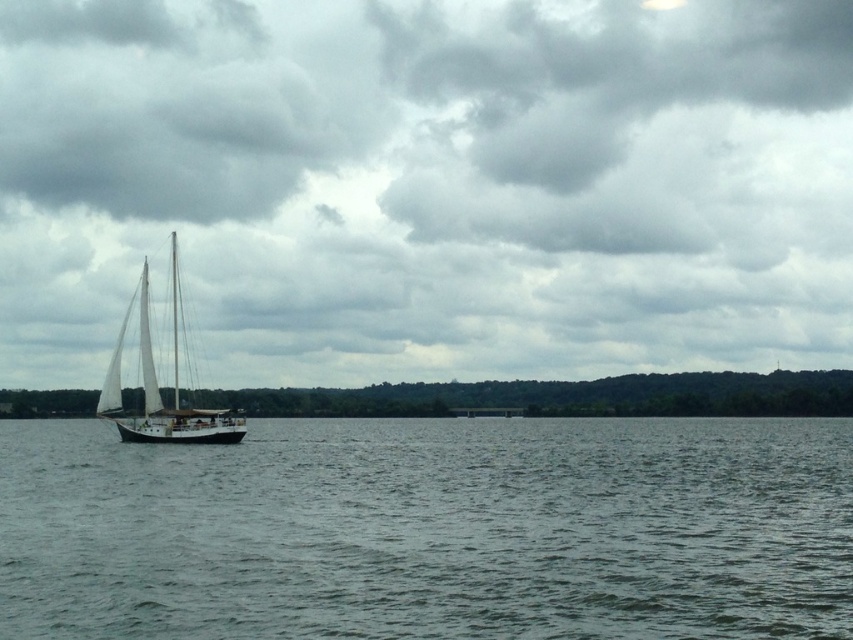
Question: Is gray water at center smaller than white matte sailboat at left?

Choices:
 (A) no
 (B) yes

Answer: (A)

Question: Among these points, which one is nearest to the camera?

Choices:
 (A) (769, 556)
 (B) (171, 294)

Answer: (A)

Question: Does gray water at center have a greater width compared to white matte sailboat at left?

Choices:
 (A) no
 (B) yes

Answer: (B)

Question: Which point is closer to the camera?

Choices:
 (A) gray water at center
 (B) white matte sailboat at left

Answer: (A)

Question: Is gray water at center below white matte sailboat at left?

Choices:
 (A) no
 (B) yes

Answer: (B)

Question: Which point is closer to the camera?

Choices:
 (A) (192, 612)
 (B) (163, 419)

Answer: (A)